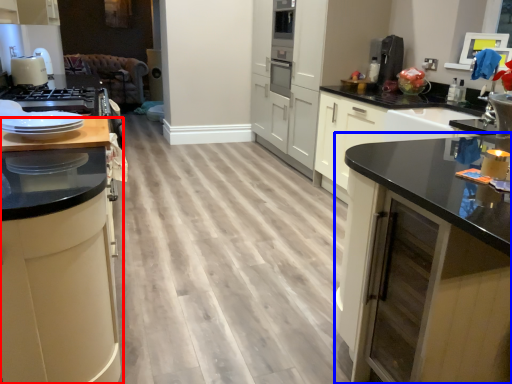
Question: Which of the following is the farthest to the observer, cabinetry (highlighted by a red box) or cabinetry (highlighted by a blue box)?

Choices:
 (A) cabinetry
 (B) cabinetry

Answer: (A)